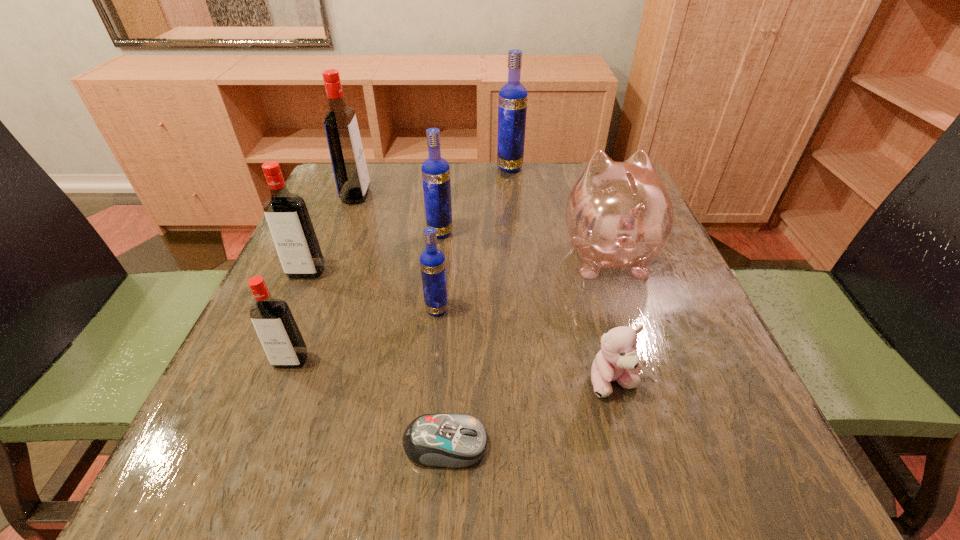
Where is `teddy bear at the right edge`? teddy bear at the right edge is located at coordinates (617, 361).

You are a GUI agent. You are given a task and a screenshot of the screen. Output one action in this format:
    pyautogui.click(x=<x>, y=<y>)
    Task: Click on the object present at the far left corner
    
    Given the screenshot: What is the action you would take?
    pyautogui.click(x=351, y=175)

At what (x,y) coordinates should I click in order to perform the action: click on vacant space at the far edge of the desktop. Please return your answer as a coordinate pair (x, y). Image resolution: width=960 pixels, height=540 pixels. Looking at the image, I should click on (474, 211).

At what (x,y) coordinates should I click in order to perform the action: click on free space at the near edge of the desktop. Please return your answer as a coordinate pair (x, y). Looking at the image, I should click on (489, 449).

In the image, there is a desktop. Identify the location of free region at the left edge. (317, 293).

In the image, there is a desktop. Where is `vacant space at the right edge`? vacant space at the right edge is located at coordinates (686, 280).

Where is `vacant space at the far left corner of the desktop`? Image resolution: width=960 pixels, height=540 pixels. vacant space at the far left corner of the desktop is located at coordinates (380, 202).

In the image, there is a desktop. At what (x,y) coordinates should I click in order to perform the action: click on free region at the near left corner. Please return your answer as a coordinate pair (x, y). Image resolution: width=960 pixels, height=540 pixels. Looking at the image, I should click on (215, 456).

The image size is (960, 540). In the image, there is a desktop. Identify the location of vacant area at the near right corner. (749, 501).

This screenshot has height=540, width=960. I want to click on vacant area between the second shortest object and the second biggest red vodka, so click(x=460, y=327).